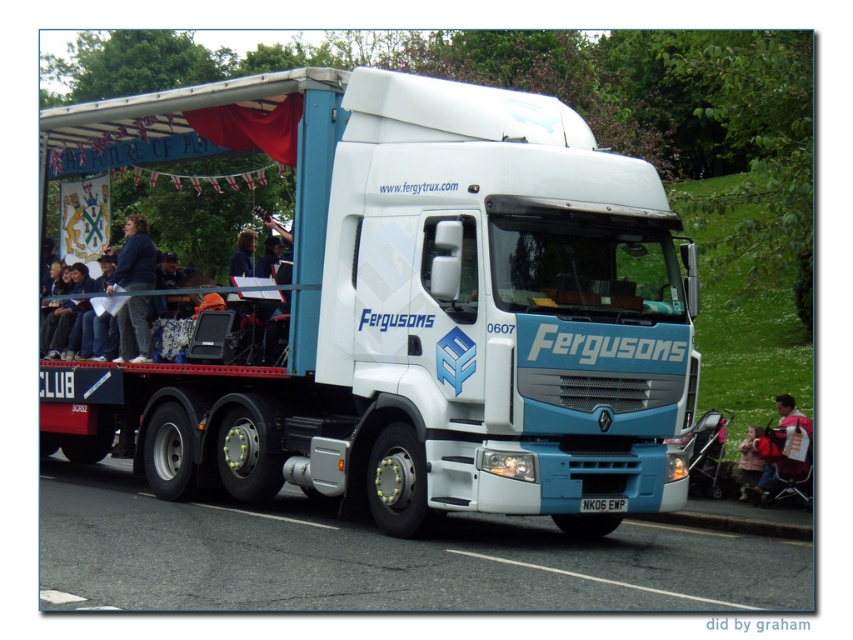
Question: Can you confirm if light pink fabric at lower right is bigger than white plastic license plate at center?

Choices:
 (A) yes
 (B) no

Answer: (A)

Question: Which object is closer to the camera taking this photo?

Choices:
 (A) white plastic license plate at center
 (B) white glossy truck at center

Answer: (A)

Question: Which of these objects is positioned farthest from the dark blue fabric at left?

Choices:
 (A) white plastic license plate at center
 (B) white glossy truck at center
 (C) light pink fabric at lower right

Answer: (C)

Question: Is dark blue fabric at left to the left of light pink fabric at lower right from the viewer's perspective?

Choices:
 (A) yes
 (B) no

Answer: (A)

Question: In this image, where is light pink fabric at lower right located relative to white plastic license plate at center?

Choices:
 (A) above
 (B) below

Answer: (A)

Question: Which object appears closest to the camera in this image?

Choices:
 (A) light pink fabric at lower right
 (B) dark blue fabric at left
 (C) white plastic license plate at center
 (D) white glossy truck at center

Answer: (C)